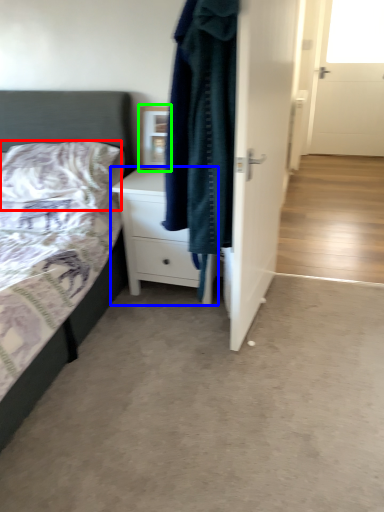
Question: Considering the real-world distances, which object is farthest from pillow (highlighted by a red box)? chest of drawers (highlighted by a blue box) or picture frame (highlighted by a green box)?

Choices:
 (A) chest of drawers
 (B) picture frame

Answer: (B)